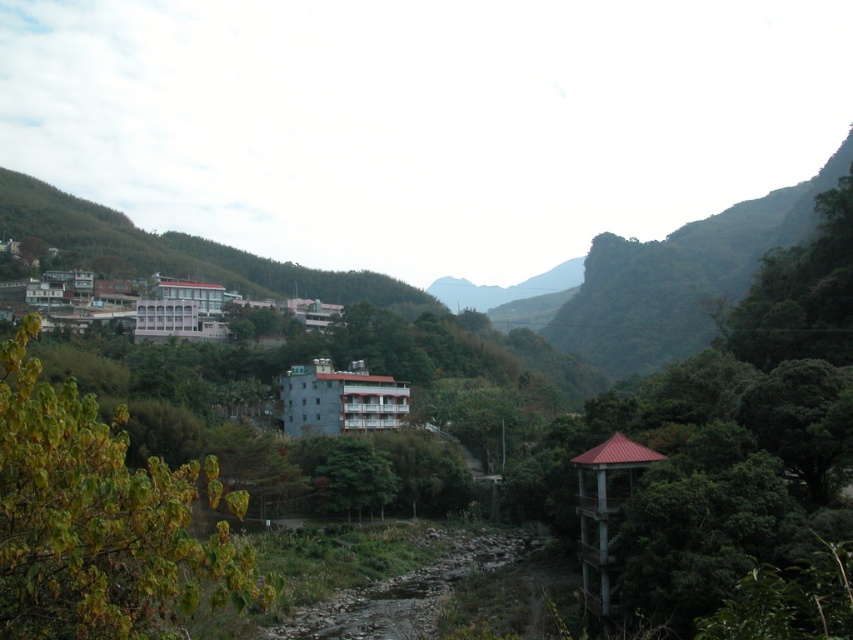
You are standing at the center of the image and want to walk towards the point marked as point (x=102, y=520). Which direction should you head to reach that point?

The point (x=102, y=520) is located at the left side of the image, so you should head towards the left to reach it.